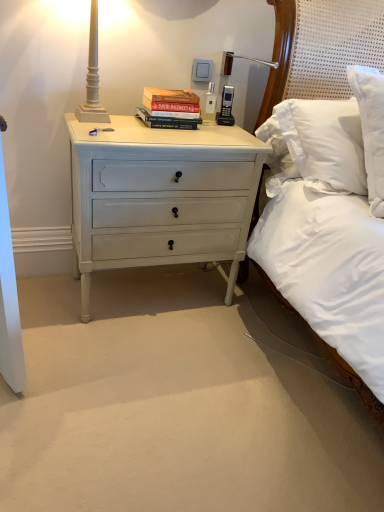
Question: Is matte white lamp at upper left thinner than white painted wood nightstand at lower left?

Choices:
 (A) no
 (B) yes

Answer: (B)

Question: Considering the relative sizes of matte white lamp at upper left and white painted wood nightstand at lower left in the image provided, is matte white lamp at upper left bigger than white painted wood nightstand at lower left?

Choices:
 (A) no
 (B) yes

Answer: (A)

Question: Is matte white lamp at upper left not within white painted wood nightstand at lower left?

Choices:
 (A) yes
 (B) no

Answer: (A)

Question: Is matte white lamp at upper left facing away from white painted wood nightstand at lower left?

Choices:
 (A) yes
 (B) no

Answer: (B)

Question: From a real-world perspective, is matte white lamp at upper left positioned over white painted wood nightstand at lower left based on gravity?

Choices:
 (A) no
 (B) yes

Answer: (B)

Question: Visually, is white painted wood nightstand at lower left positioned to the left or to the right of matte white lamp at upper left?

Choices:
 (A) left
 (B) right

Answer: (B)

Question: Considering their positions, is white painted wood nightstand at lower left located in front of or behind matte white lamp at upper left?

Choices:
 (A) front
 (B) behind

Answer: (B)

Question: Considering the positions of white painted wood nightstand at lower left and matte white lamp at upper left in the image, is white painted wood nightstand at lower left wider or thinner than matte white lamp at upper left?

Choices:
 (A) thin
 (B) wide

Answer: (B)

Question: Is white painted wood nightstand at lower left taller or shorter than matte white lamp at upper left?

Choices:
 (A) tall
 (B) short

Answer: (A)

Question: Is point (92, 36) closer or farther from the camera than point (144, 96)?

Choices:
 (A) closer
 (B) farther

Answer: (A)

Question: Looking at the image, does matte white lamp at upper left seem bigger or smaller compared to hardcover books at center?

Choices:
 (A) big
 (B) small

Answer: (A)

Question: From a real-world perspective, is matte white lamp at upper left above or below hardcover books at center?

Choices:
 (A) above
 (B) below

Answer: (A)

Question: In terms of height, does matte white lamp at upper left look taller or shorter compared to hardcover books at center?

Choices:
 (A) short
 (B) tall

Answer: (B)

Question: In terms of height, does matte white lamp at upper left look taller or shorter compared to white painted wood nightstand at lower left?

Choices:
 (A) tall
 (B) short

Answer: (B)

Question: Does point (76, 113) appear closer or farther from the camera than point (147, 265)?

Choices:
 (A) farther
 (B) closer

Answer: (B)